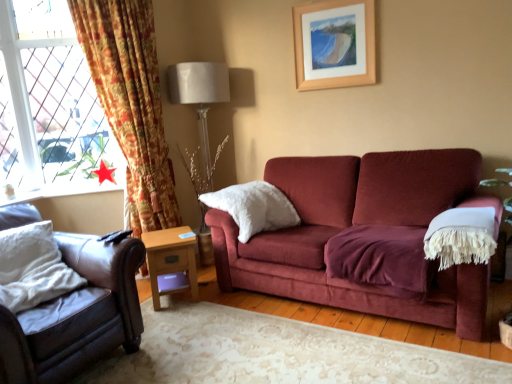
The image size is (512, 384). Find the location of `vacant area that is in front of red fabric star at lower left`. vacant area that is in front of red fabric star at lower left is located at coordinates (100, 183).